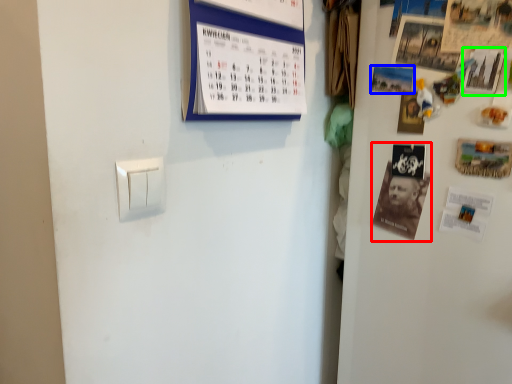
Question: Which is farther away from magazine (highlighted by a red box)? poster (highlighted by a blue box) or poster (highlighted by a green box)?

Choices:
 (A) poster
 (B) poster

Answer: (B)